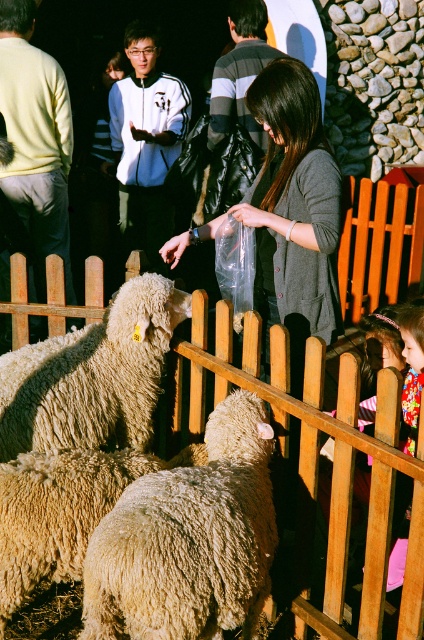
Question: Does fluffy beige wool at center have a smaller size compared to fuzzy woolen sheep at center?

Choices:
 (A) no
 (B) yes

Answer: (A)

Question: Which point is closer to the camera?

Choices:
 (A) fluffy beige wool at center
 (B) wooden fence at center

Answer: (B)

Question: Which point is closer to the camera?

Choices:
 (A) (287, 196)
 (B) (161, 326)
 (C) (329, 433)
 (D) (164, 564)

Answer: (D)

Question: Which point appears farthest from the camera in this image?

Choices:
 (A) (307, 292)
 (B) (136, 349)
 (C) (248, 576)
 (D) (61, 280)

Answer: (D)

Question: Does fluffy woolen sheep at center appear on the right side of gray sweater at center?

Choices:
 (A) no
 (B) yes

Answer: (A)

Question: Observing the image, what is the correct spatial positioning of gray sweater at center in reference to fluffy beige wool at center?

Choices:
 (A) right
 (B) left

Answer: (A)